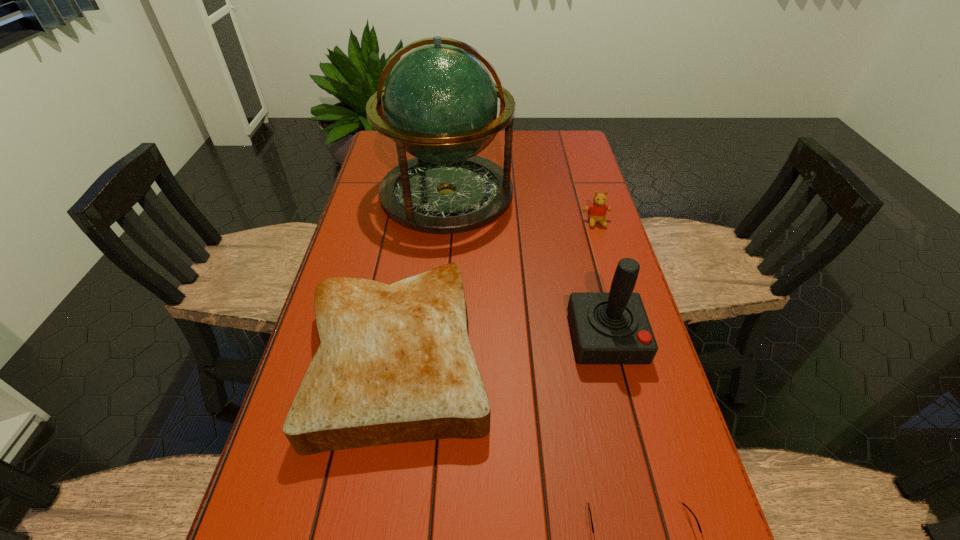
The width and height of the screenshot is (960, 540). Identify the location of bread that is at the left edge. (395, 364).

At what (x,y) coordinates should I click in order to perform the action: click on joystick located in the right edge section of the desktop. Please return your answer as a coordinate pair (x, y). The height and width of the screenshot is (540, 960). Looking at the image, I should click on (608, 328).

Where is `teddy bear that is at the right edge`? teddy bear that is at the right edge is located at coordinates (596, 211).

You are a GUI agent. You are given a task and a screenshot of the screen. Output one action in this format:
    pyautogui.click(x=<x>, y=<y>)
    Task: Click on the object present at the far left corner
    This screenshot has height=540, width=960.
    Given the screenshot: What is the action you would take?
    pyautogui.click(x=440, y=103)

The image size is (960, 540). What are the coordinates of `free point at the far edge` in the screenshot? It's located at (517, 140).

Identify the location of free space at the left edge of the desktop. Image resolution: width=960 pixels, height=540 pixels. (347, 260).

Locate an element on the screen. The image size is (960, 540). vacant space at the right edge of the desktop is located at coordinates (611, 256).

The image size is (960, 540). In order to click on vacant space at the far left corner of the desktop in this screenshot , I will do pyautogui.click(x=386, y=152).

What are the coordinates of `free space that is in between the joystick and the bread` in the screenshot? It's located at (502, 347).

Locate an element on the screen. Image resolution: width=960 pixels, height=540 pixels. free space between the third tallest object and the second shortest object is located at coordinates (497, 289).